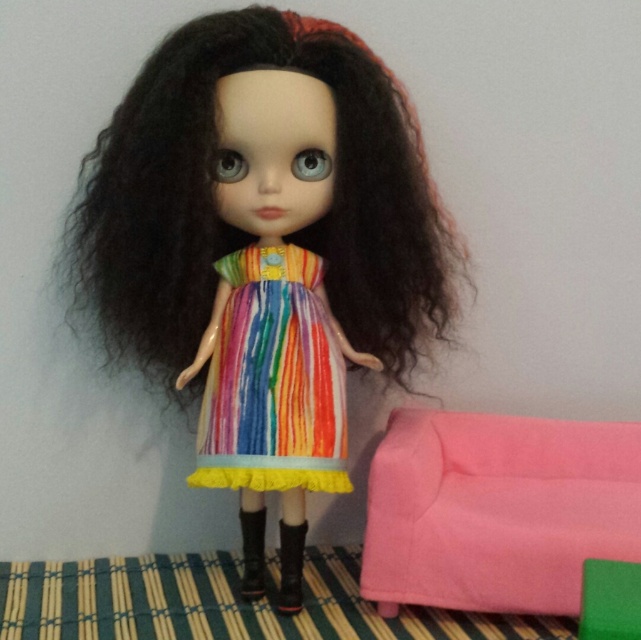
You are a child trying to reach the pink fabric couch at lower right from where you are standing. The matte plastic doll at center is in your way. Can you walk around the doll to reach the couch?

The pink fabric couch at lower right is behind the matte plastic doll at center, so you can walk around the doll to reach the couch.

In the scene shown: You are standing in front of a display case containing the matte plastic doll at center. The case has a glass front that is 1.2 meters tall. Can you see the entire doll from head to toe without bending down?

The matte plastic doll at center is 1.12 meters away from the viewer. Since the glass front is 1.2 meters tall, which is taller than the distance between the viewer and the doll, you can see the entire doll from head to toe without bending down.

You are standing 5 feet away from the point at coordinates point (510, 433). Can you reach it without moving your feet?

The distance of point (510, 433) from viewer is 4.32 feet, so yes, you can reach it without moving your feet since you are standing 5 feet away which is farther than the point.